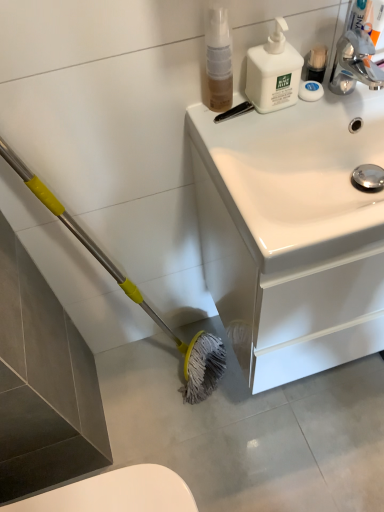
Identify the location of vacant area situated to the left side of white matte pump bottle at upper right, the second cleaning product in the left-to-right sequence. The width and height of the screenshot is (384, 512). (227, 117).